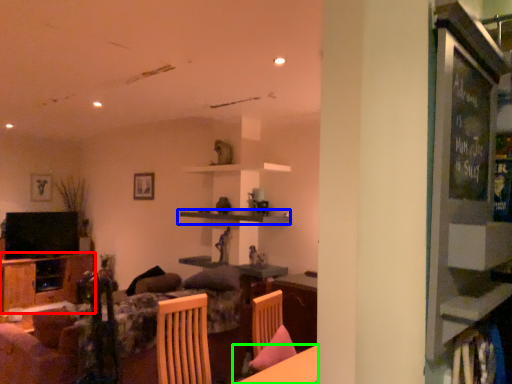
Question: Which object is positioned farthest from cabinetry (highlighted by a red box)? Select from shelf (highlighted by a blue box) and table (highlighted by a green box).

Choices:
 (A) shelf
 (B) table

Answer: (B)